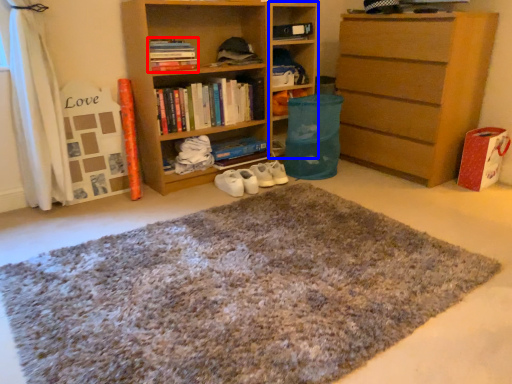
Question: Which object is further to the camera taking this photo, book (highlighted by a red box) or cabinet (highlighted by a blue box)?

Choices:
 (A) book
 (B) cabinet

Answer: (B)